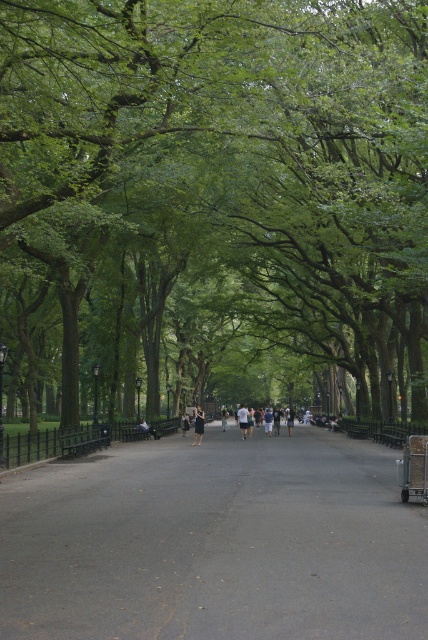
You are standing at the starting point of the park pathway. There is a dark asphalt road at center. If you walk straight ahead, will you eventually reach the point marked as point (x=214, y=541)?

Yes, because the point (x=214, y=541) indicates the dark asphalt road at center, so walking straight ahead along the path will lead you directly to that point.

You are standing at the entrance of the park and want to reach the dark asphalt road at center. According to the map coordinates, where should you head towards?

The dark asphalt road at center is located at point [214,541], so you should head towards that coordinate to reach it.